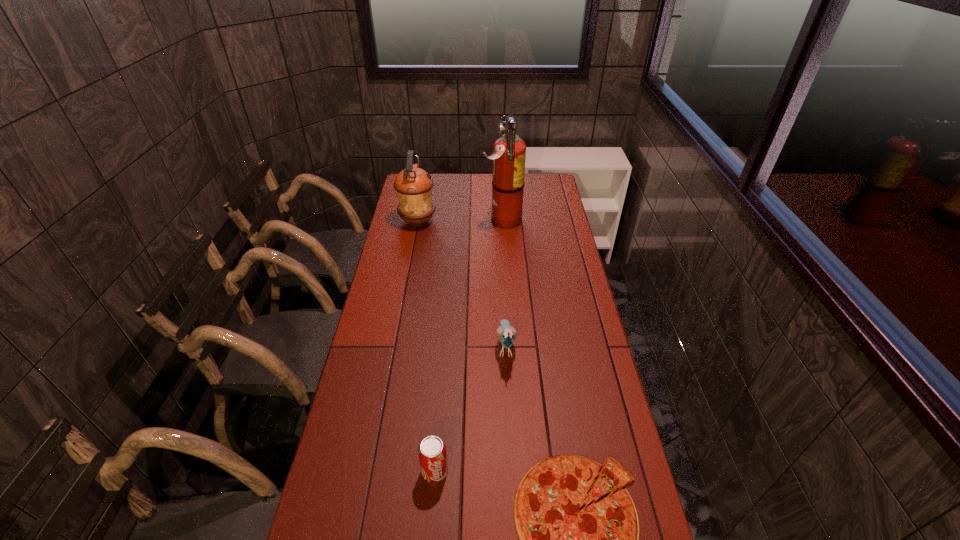
Identify the location of unoccupied area between the fourth tallest object and the third tallest object. The image size is (960, 540). (470, 408).

What are the coordinates of `unoccupied position between the third nearest object and the tallest object` in the screenshot? It's located at (503, 284).

I want to click on object that is the second closest to the tallest object, so click(506, 334).

Image resolution: width=960 pixels, height=540 pixels. In order to click on the third closest object to the shortest object in this screenshot , I will do `click(509, 151)`.

Image resolution: width=960 pixels, height=540 pixels. I want to click on vacant space that satisfies the following two spatial constraints: 1. from the nozzle of the fire extinguisher; 2. at the face of the third nearest object, so click(x=510, y=346).

Locate an element on the screen. This screenshot has height=540, width=960. free point that satisfies the following two spatial constraints: 1. from the nozzle of the tallest object; 2. on the front side of the soda can is located at coordinates (518, 471).